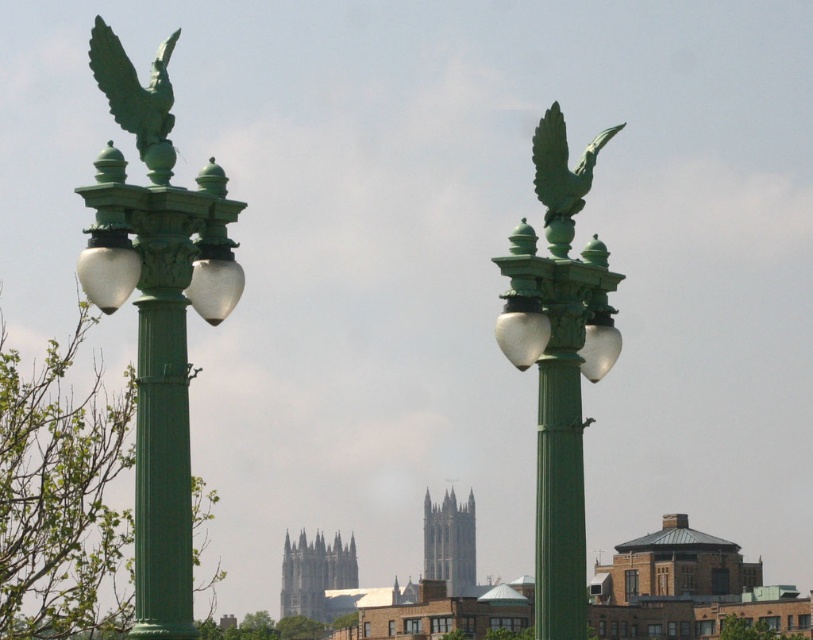
Locate an element on the screen. This screenshot has height=640, width=813. green stone tower at center is located at coordinates (314, 573).

Which is behind, point (329, 548) or point (455, 524)?

The point (329, 548) is behind.

Identify the location of green stone tower at center. This screenshot has width=813, height=640. (314, 573).

Who is positioned more to the left, green polished metal street light at upper center or gray stone tower at center?

Positioned to the left is gray stone tower at center.

Who is more forward, (567, 396) or (433, 516)?

Point (567, 396) is in front.

The image size is (813, 640). Describe the element at coordinates (559, 364) in the screenshot. I see `green polished metal street light at upper center` at that location.

You are a GUI agent. You are given a task and a screenshot of the screen. Output one action in this format:
    pyautogui.click(x=<x>, y=<y>)
    Task: Click on the green polished metal street light at upper center
    The height and width of the screenshot is (640, 813).
    Given the screenshot: What is the action you would take?
    pyautogui.click(x=559, y=364)

How distant is green patina eagle at upper left from gray stone tower at center?

They are 448.85 meters apart.

Is green patina eagle at upper left shorter than gray stone tower at center?

Correct, green patina eagle at upper left is not as tall as gray stone tower at center.

Describe the element at coordinates (133, 86) in the screenshot. This screenshot has width=813, height=640. I see `green patina eagle at upper left` at that location.

I want to click on green patina eagle at upper left, so click(x=133, y=86).